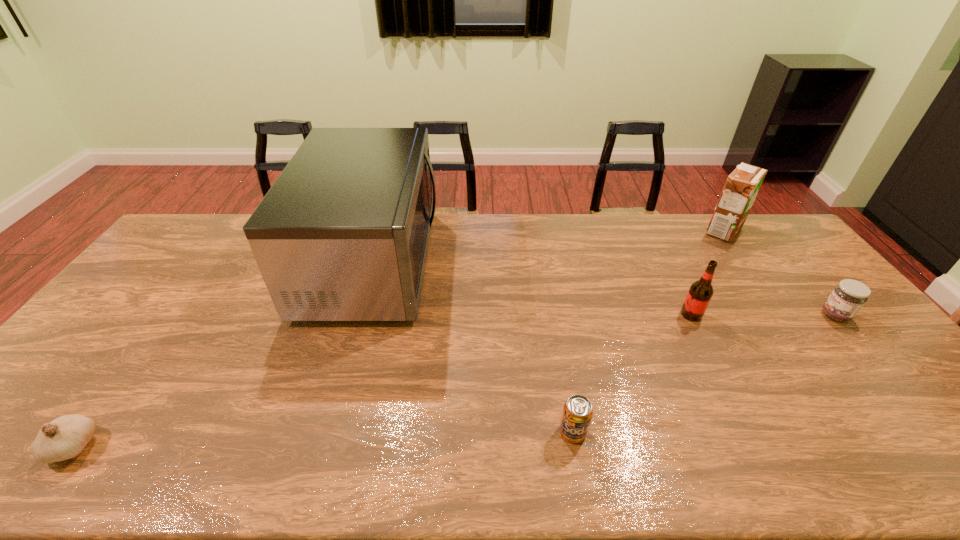
The height and width of the screenshot is (540, 960). In order to click on vacant region that satisfies the following two spatial constraints: 1. on the front-facing side of the microwave oven; 2. on the back side of the root beer in this screenshot , I will do `click(356, 314)`.